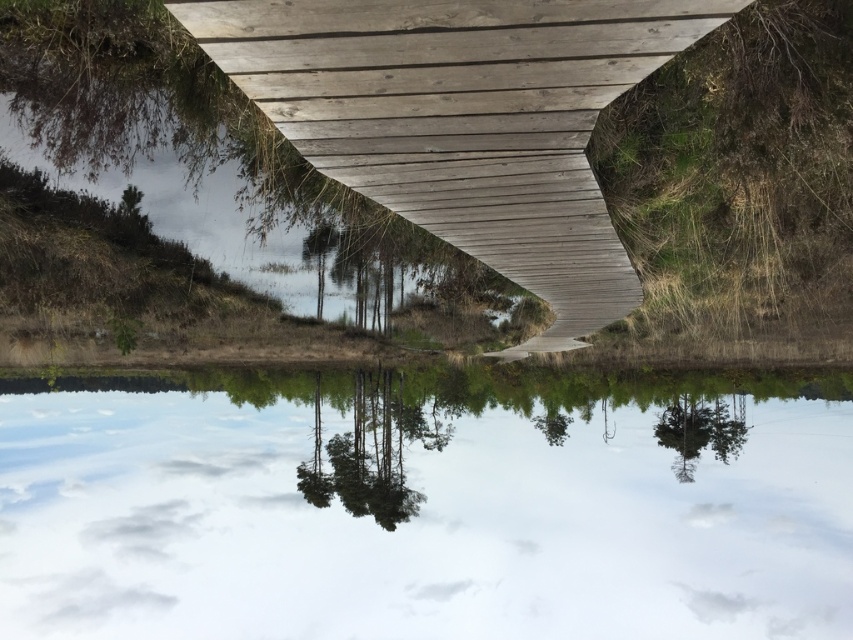
Can you confirm if transparent glass river at center is positioned below green matte trees at center?

Yes.

Is transparent glass river at center taller than green matte trees at center?

Correct, transparent glass river at center is much taller as green matte trees at center.

Locate an element on the screen. The image size is (853, 640). transparent glass river at center is located at coordinates (419, 506).

Is the position of transparent glass river at center less distant than that of green matte tree at lower right?

That is True.

The width and height of the screenshot is (853, 640). What do you see at coordinates (419, 506) in the screenshot? I see `transparent glass river at center` at bounding box center [419, 506].

Which is in front, point (323, 602) or point (677, 440)?

Positioned in front is point (677, 440).

Where is `transparent glass river at center`? transparent glass river at center is located at coordinates (419, 506).

This screenshot has height=640, width=853. What do you see at coordinates (463, 120) in the screenshot? I see `natural wood foot bridge at center` at bounding box center [463, 120].

How distant is natural wood foot bridge at center from green matte tree at lower right?

The distance of natural wood foot bridge at center from green matte tree at lower right is 27.73 meters.

I want to click on natural wood foot bridge at center, so click(x=463, y=120).